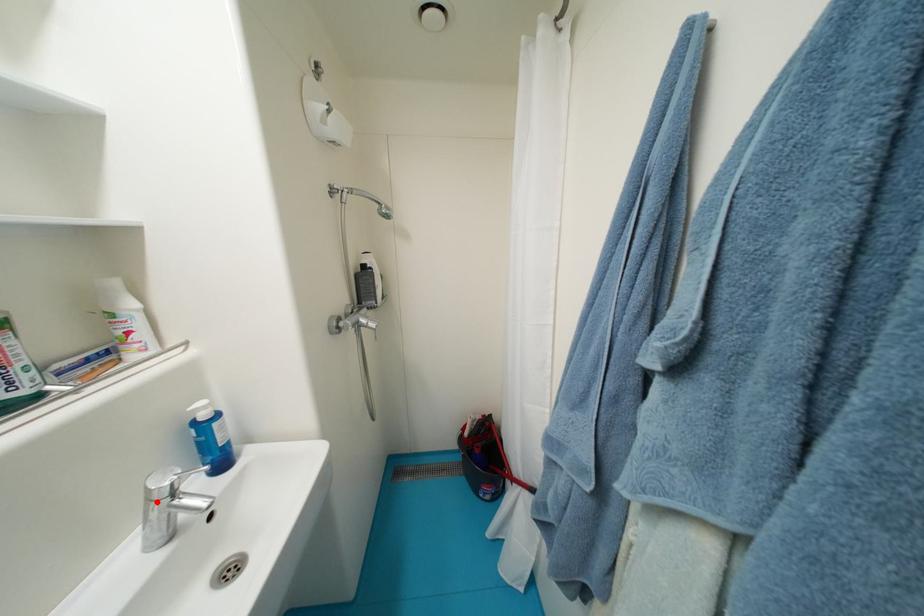
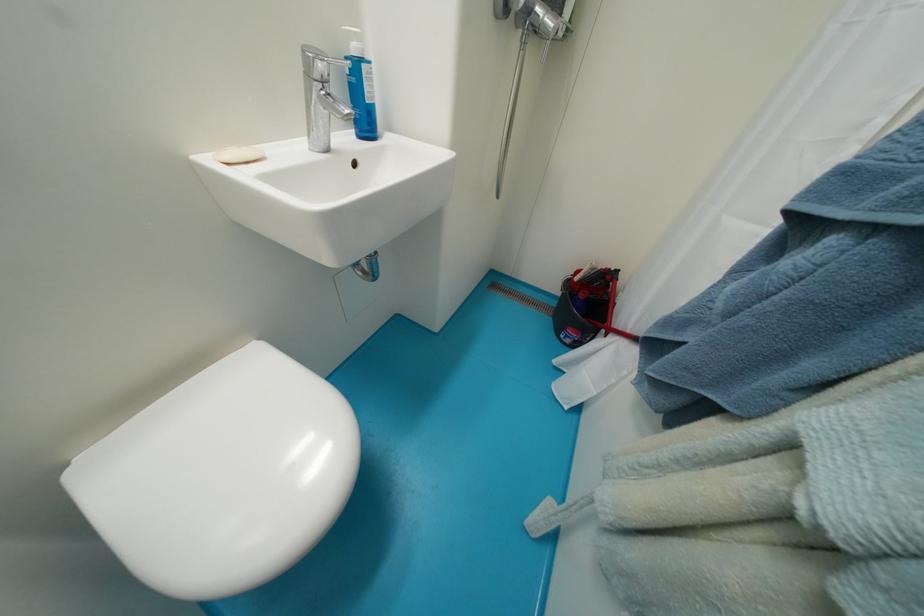
Question: I am providing you with two images of the same scene from different viewpoints. Image1 has a red point marked. In image2, the corresponding 3D location appears at what relative position? Reply with the corresponding letter.

Choices:
 (A) Closer
 (B) Farther

Answer: (B)